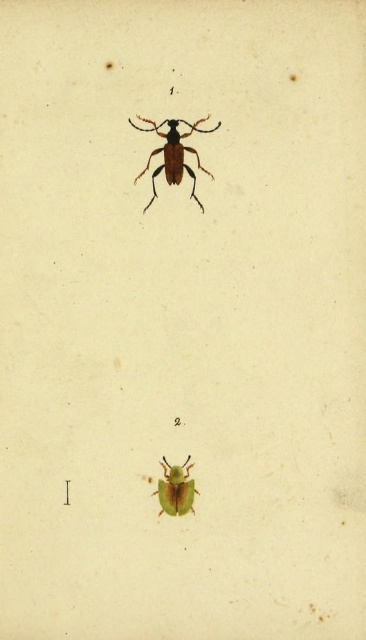
Question: Can you confirm if matte brown beetle at upper center is positioned above green matte beetle at lower center?

Choices:
 (A) yes
 (B) no

Answer: (A)

Question: Which of the following is the closest to the observer?

Choices:
 (A) (189, 456)
 (B) (152, 172)

Answer: (B)

Question: Is matte brown beetle at upper center positioned at the back of green matte beetle at lower center?

Choices:
 (A) no
 (B) yes

Answer: (A)

Question: Does matte brown beetle at upper center appear over green matte beetle at lower center?

Choices:
 (A) yes
 (B) no

Answer: (A)

Question: Which object appears closest to the camera in this image?

Choices:
 (A) matte brown beetle at upper center
 (B) green matte beetle at lower center

Answer: (A)